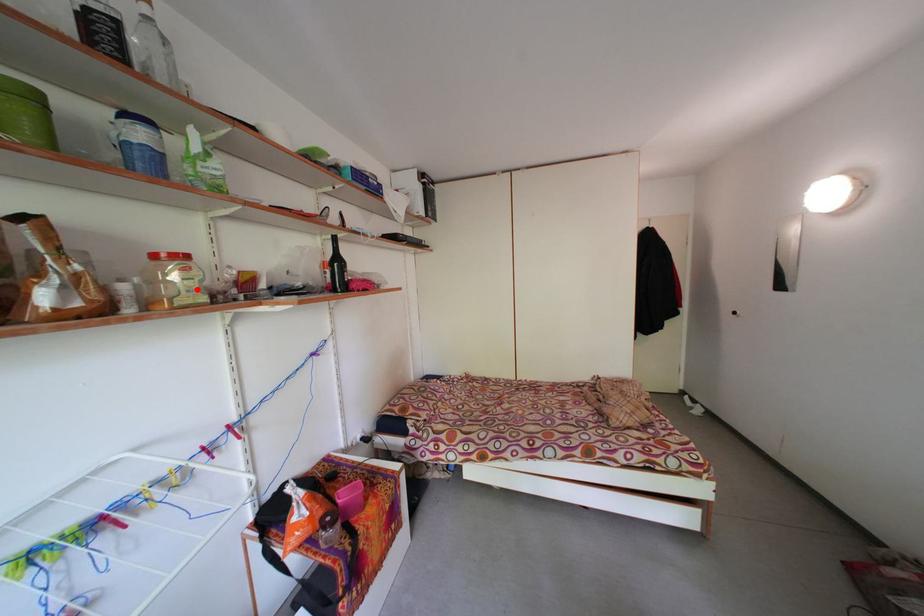
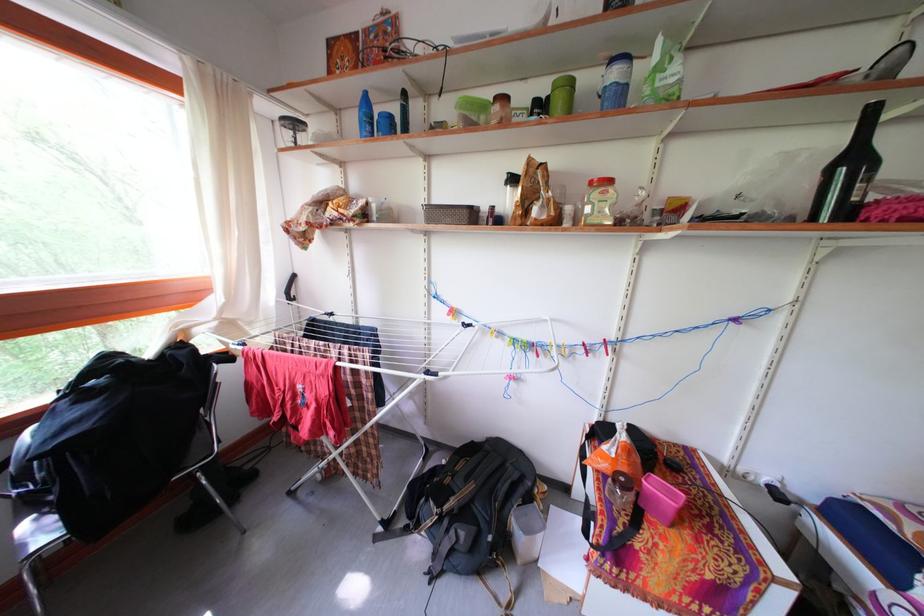
In the second image, find the point that corresponds to the highlighted location in the first image.

(611, 211)